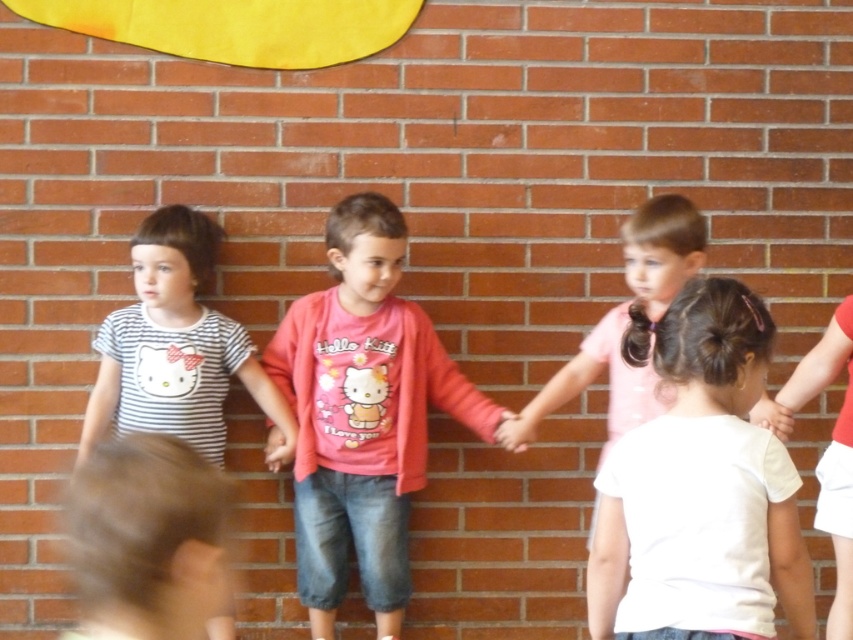
Question: Is pink cotton shirt at center closer to the viewer compared to striped cotton shirt at left?

Choices:
 (A) no
 (B) yes

Answer: (B)

Question: Which of these objects is positioned closest to the matte pink shirt at center?

Choices:
 (A) white matte shirt at center
 (B) smooth skin hand at center
 (C) pink cotton shirt at center

Answer: (C)

Question: Which object appears farthest from the camera in this image?

Choices:
 (A) smooth skin hand at center
 (B) striped cotton shirt at left
 (C) white matte hand at lower right

Answer: (A)

Question: Is smooth skin hand at center to the right of matte pink shirt at center from the viewer's perspective?

Choices:
 (A) yes
 (B) no

Answer: (A)

Question: Estimate the real-world distances between objects in this image. Which object is closer to the white matte shirt at center?

Choices:
 (A) pink cotton shirt at center
 (B) white matte hand at lower right
 (C) smooth skin hand at center
 (D) matte pink shirt at center

Answer: (B)

Question: Is the position of smooth skin hand at center less distant than that of white matte hand at lower right?

Choices:
 (A) yes
 (B) no

Answer: (B)